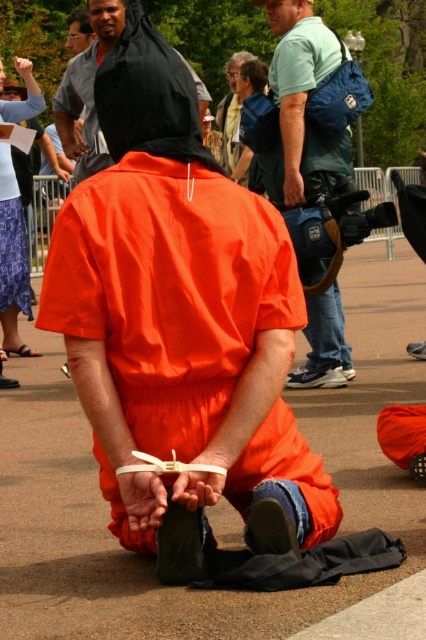
Question: Among these objects, which one is nearest to the camera?

Choices:
 (A) denim skirt at upper left
 (B) smooth blue shirt at upper center

Answer: (A)

Question: Estimate the real-world distances between objects in this image. Which object is closer to the orange matte jumpsuit at center?

Choices:
 (A) smooth blue shirt at upper center
 (B) blue-green fabric shirt at upper center

Answer: (B)

Question: Can you confirm if denim skirt at upper left is bigger than matte black hoodie at upper center?

Choices:
 (A) yes
 (B) no

Answer: (A)

Question: Which point is closer to the camera?

Choices:
 (A) smooth asphalt pavement at center
 (B) orange matte jumpsuit at center

Answer: (B)

Question: Does black matte hood at upper center appear on the left side of denim skirt at upper left?

Choices:
 (A) no
 (B) yes

Answer: (A)

Question: Does smooth asphalt pavement at center appear on the right side of smooth blue shirt at upper center?

Choices:
 (A) no
 (B) yes

Answer: (B)